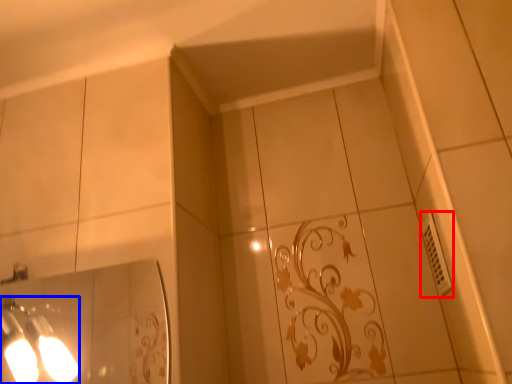
Question: Among these objects, which one is farthest to the camera, electric outlet (highlighted by a red box) or light fixture (highlighted by a blue box)?

Choices:
 (A) electric outlet
 (B) light fixture

Answer: (A)